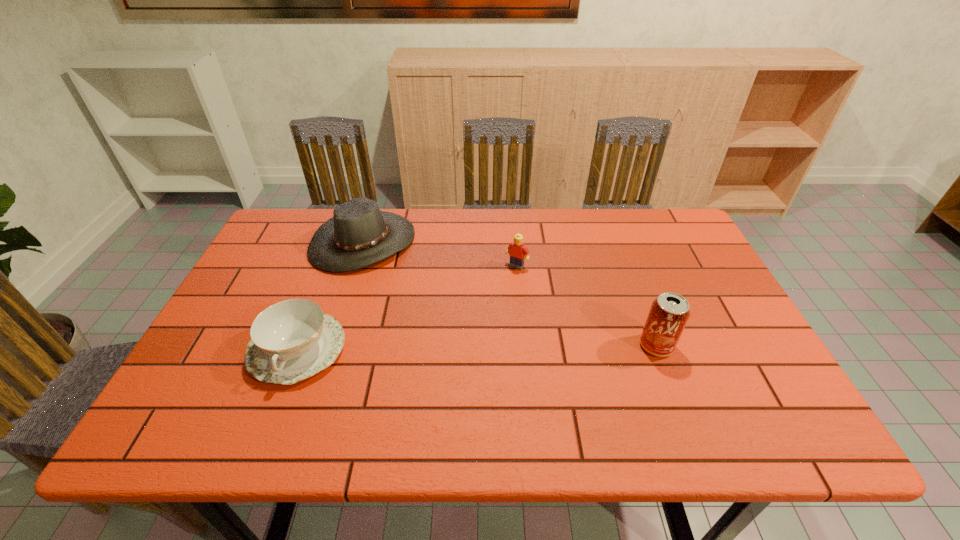
This screenshot has width=960, height=540. Identify the location of vacant space on the desktop that is between the shortest object and the tallest object and is positioned on the front-facing side of the third object from left to right. (461, 347).

Where is `free space on the desktop that is between the chinaware and the soda can and is positioned on the front-facing side of the hat`? The height and width of the screenshot is (540, 960). free space on the desktop that is between the chinaware and the soda can and is positioned on the front-facing side of the hat is located at coordinates (496, 347).